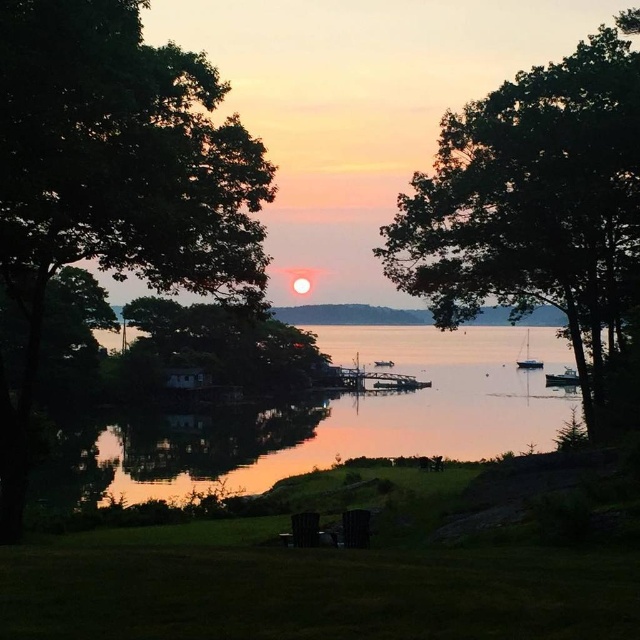
Image resolution: width=640 pixels, height=640 pixels. Describe the element at coordinates (563, 378) in the screenshot. I see `wooden fishing boat at lower right` at that location.

Measure the distance between wooden fishing boat at lower right and metallic silver boat at center.

wooden fishing boat at lower right and metallic silver boat at center are 15.35 meters apart.

In order to click on wooden fishing boat at lower right in this screenshot , I will do `click(563, 378)`.

Is green leafy tree at left further to camera compared to white glossy sailboat at center?

No, green leafy tree at left is in front of white glossy sailboat at center.

Does green leafy tree at left have a smaller size compared to white glossy sailboat at center?

No.

What do you see at coordinates (113, 179) in the screenshot?
I see `green leafy tree at left` at bounding box center [113, 179].

At what (x,y) coordinates should I click in order to perform the action: click on green leafy tree at left. Please return your answer as a coordinate pair (x, y). Looking at the image, I should click on (113, 179).

Measure the distance between green leafy tree at left and wooden fishing boat at lower right.

green leafy tree at left is 75.83 meters away from wooden fishing boat at lower right.

Does green leafy tree at left appear under wooden fishing boat at lower right?

Actually, green leafy tree at left is above wooden fishing boat at lower right.

What do you see at coordinates (113, 179) in the screenshot? I see `green leafy tree at left` at bounding box center [113, 179].

What are the coordinates of `green leafy tree at left` in the screenshot? It's located at (113, 179).